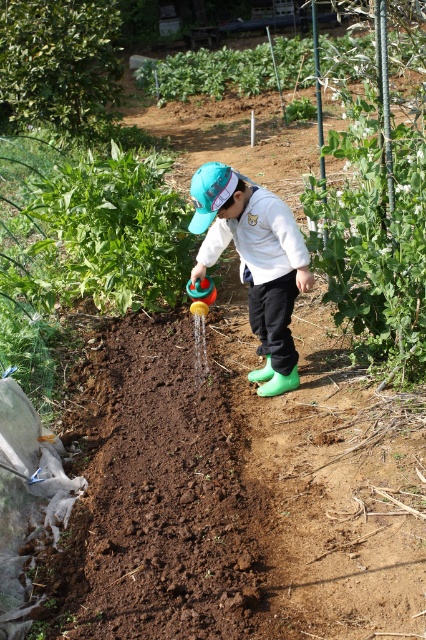
Based on the coordinates provided, where is the green leafy plant at right located in the image?

The green leafy plant at right is located at the coordinates point (377, 228).

You are a gardener who needs to water the green leafy plant at right and the rubber boots at center. The watering can has a range of 23 inches. Can you water both without moving the watering can?

The green leafy plant at right and the rubber boots at center are 23.19 inches apart. Since the watering can has a range of 23 inches, the distance is slightly beyond its reach. You would need to move the watering can to water both.

You are a photographer trying to capture the rubber boots at center and the green leafy plant at upper center in a single shot. Which object will appear larger in the photo?

The rubber boots at center will appear larger in the photo because it is closer to the viewer than the green leafy plant at upper center.